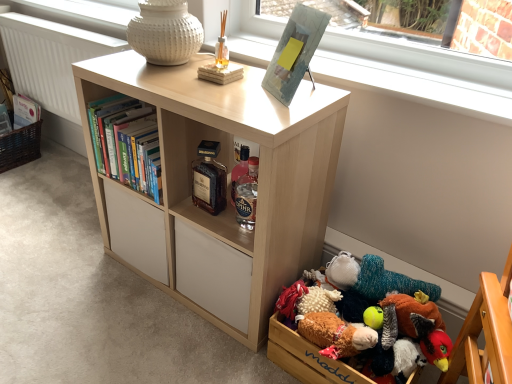
Question: Considering the relative positions of wooden plush toys at lower right and light wood bookcase at center in the image provided, is wooden plush toys at lower right behind light wood bookcase at center?

Choices:
 (A) yes
 (B) no

Answer: (A)

Question: Is wooden plush toys at lower right facing towards light wood bookcase at center?

Choices:
 (A) no
 (B) yes

Answer: (A)

Question: From the image's perspective, is wooden plush toys at lower right located above light wood bookcase at center?

Choices:
 (A) no
 (B) yes

Answer: (A)

Question: Can you confirm if wooden plush toys at lower right is bigger than light wood bookcase at center?

Choices:
 (A) no
 (B) yes

Answer: (A)

Question: Can you confirm if wooden plush toys at lower right is wider than light wood bookcase at center?

Choices:
 (A) no
 (B) yes

Answer: (A)

Question: Is point (429, 324) positioned closer to the camera than point (273, 337)?

Choices:
 (A) closer
 (B) farther

Answer: (A)

Question: From the image's perspective, relative to fluffy multicolored stuffed toys at lower right, placed as the third toy when sorted from back to front, is fluffy multicolored stuffed animal at lower right, which is the second toy from back to front, above or below?

Choices:
 (A) above
 (B) below

Answer: (A)

Question: Is fluffy multicolored stuffed animal at lower right, which is counted as the 2th toy, starting from the front, inside the boundaries of fluffy multicolored stuffed toys at lower right, placed as the third toy when sorted from back to front, or outside?

Choices:
 (A) inside
 (B) outside

Answer: (B)

Question: Relative to fluffy multicolored stuffed toys at lower right, the first toy viewed from the front, is fluffy multicolored stuffed animal at lower right, which is counted as the 2th toy, starting from the front, in front or behind?

Choices:
 (A) front
 (B) behind

Answer: (B)

Question: Considering the positions of point (246, 208) and point (298, 370), is point (246, 208) closer or farther from the camera than point (298, 370)?

Choices:
 (A) closer
 (B) farther

Answer: (A)

Question: Considering their positions, is translucent glass bottle at center, which ranks as the second bottle in left-to-right order, located in front of or behind fluffy multicolored stuffed toys at lower right, the first toy viewed from the front?

Choices:
 (A) behind
 (B) front

Answer: (A)

Question: Which is correct: translucent glass bottle at center, which ranks as the second bottle in left-to-right order, is inside fluffy multicolored stuffed toys at lower right, the first toy viewed from the front, or outside of it?

Choices:
 (A) outside
 (B) inside

Answer: (A)

Question: From a real-world perspective, relative to fluffy multicolored stuffed toys at lower right, placed as the third toy when sorted from back to front, is translucent glass bottle at center, the first bottle from the right, vertically above or below?

Choices:
 (A) below
 (B) above

Answer: (B)

Question: Choose the correct answer: Is hardcover books at left inside brown glass bottle at center, which ranks as the 1th bottle in left-to-right order, or outside it?

Choices:
 (A) inside
 (B) outside

Answer: (B)

Question: From the image's perspective, relative to brown glass bottle at center, which ranks as the 1th bottle in left-to-right order, is hardcover books at left above or below?

Choices:
 (A) above
 (B) below

Answer: (A)